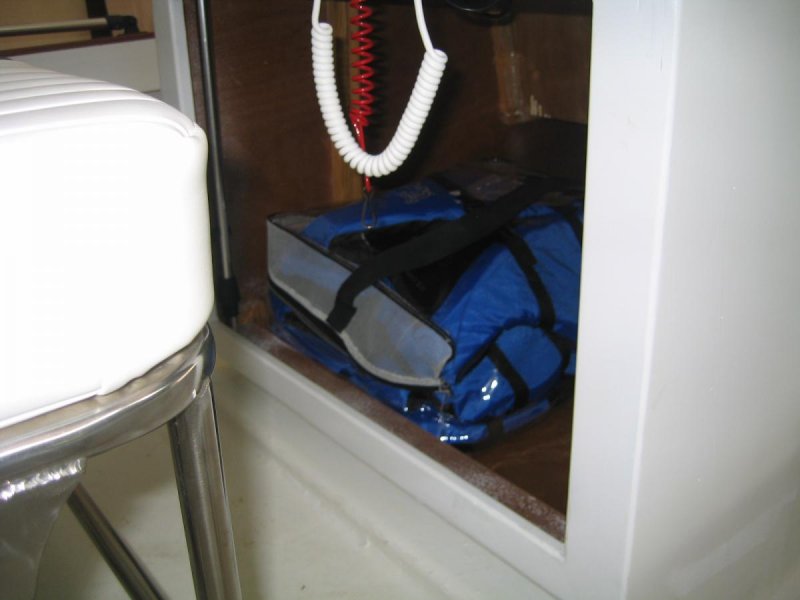
Image resolution: width=800 pixels, height=600 pixels. What are the coordinates of `corner edge of cupboard` in the screenshot? It's located at (638, 441), (158, 59).